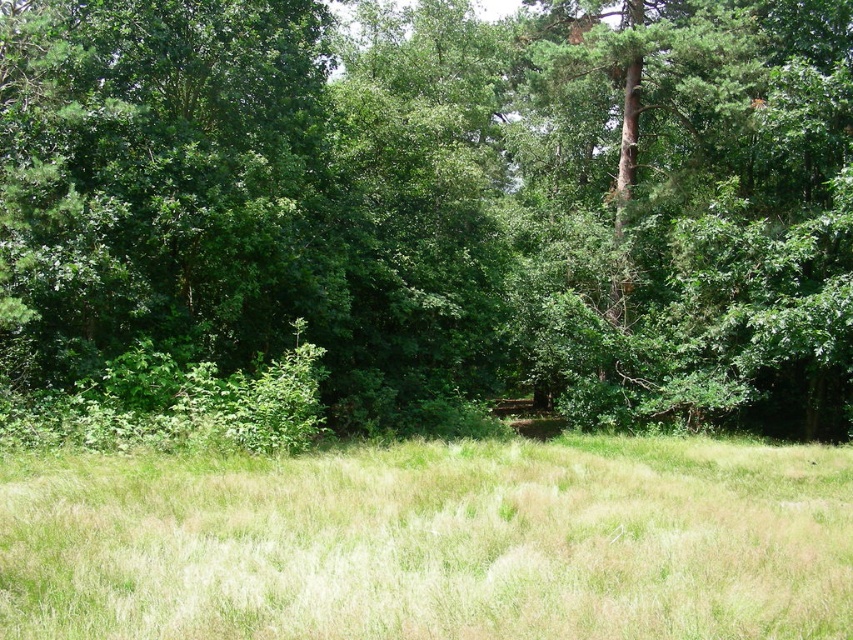
You are standing in the middle of the green grassy field at center and want to reach the green leafy tree at center. Which direction should you walk to get closer to the tree?

The green leafy tree at center is taller than the green grassy field at center, but since both are at the center, you are already at the location of the tree. However, if you are on the field, you might need to look up to see the tree, but direction isn